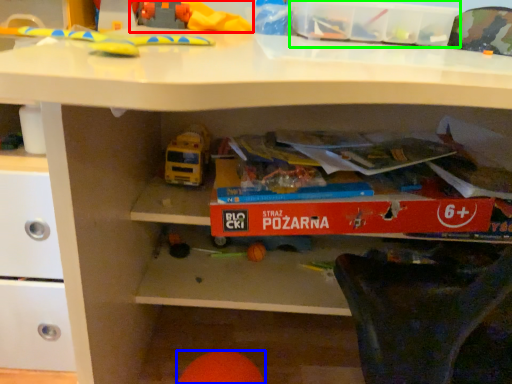
Question: Which is farther away from toy (highlighted by a red box)? toy (highlighted by a blue box) or storage box (highlighted by a green box)?

Choices:
 (A) toy
 (B) storage box

Answer: (A)